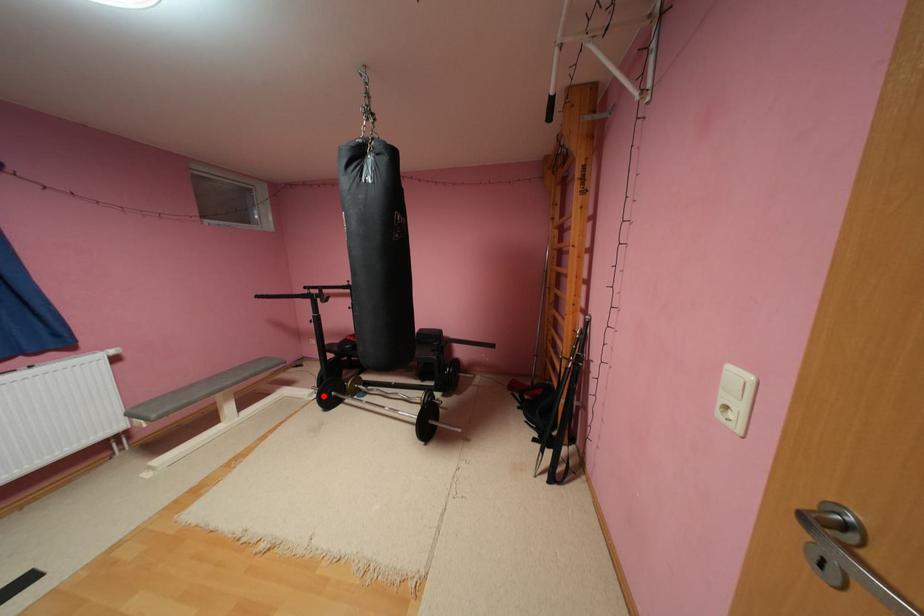
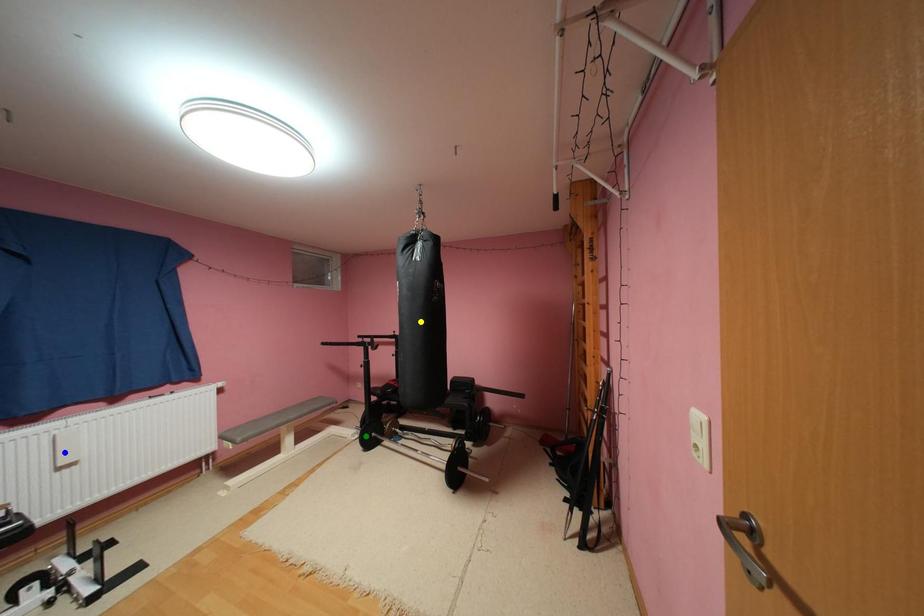
Question: I am providing you with two images of the same scene from different viewpoints. A red point is marked on the first image. You are given multiple points on the second image. Which spot in image 2 lines up with the point in image 1?

Choices:
 (A) blue point
 (B) yellow point
 (C) green point

Answer: (C)